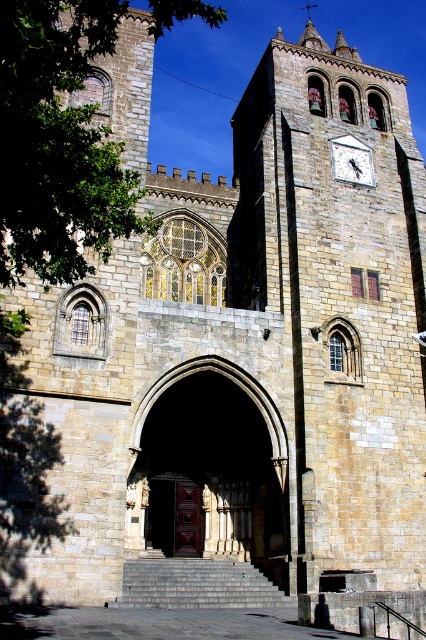
Question: Which point appears closest to the camera in this image?

Choices:
 (A) (170, 512)
 (B) (259, 596)
 (C) (362, 150)

Answer: (B)

Question: Which of the following is the closest to the observer?

Choices:
 (A) brown wooden door at center
 (B) white stone clock at upper right
 (C) gray stone stairs at center

Answer: (C)

Question: From the image, what is the correct spatial relationship of stone archway at center in relation to white stone clock at upper right?

Choices:
 (A) left
 (B) right

Answer: (A)

Question: Can you confirm if stone archway at center is smaller than gray stone stairs at center?

Choices:
 (A) yes
 (B) no

Answer: (B)

Question: Which point is farther from the camera taking this photo?

Choices:
 (A) (258, 464)
 (B) (230, 570)
 (C) (172, 484)

Answer: (C)

Question: Is stone archway at center bigger than white stone clock at upper right?

Choices:
 (A) no
 (B) yes

Answer: (B)